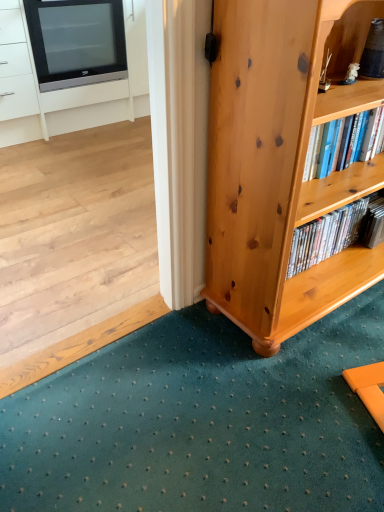
Question: Do you think black glossy television at upper left is within matte black tv at upper left, or outside of it?

Choices:
 (A) outside
 (B) inside

Answer: (B)

Question: In the image, is black glossy television at upper left positioned in front of or behind matte black tv at upper left?

Choices:
 (A) front
 (B) behind

Answer: (B)

Question: Considering the real-world distances, which object is farthest from the light brown wood bookcase at lower right?

Choices:
 (A) black glossy television at upper left
 (B) teal carpet at lower center
 (C) matte black tv at upper left

Answer: (A)

Question: Estimate the real-world distances between objects in this image. Which object is farther from the light brown wood bookcase at lower right?

Choices:
 (A) matte black tv at upper left
 (B) teal carpet at lower center
 (C) black glossy television at upper left

Answer: (C)